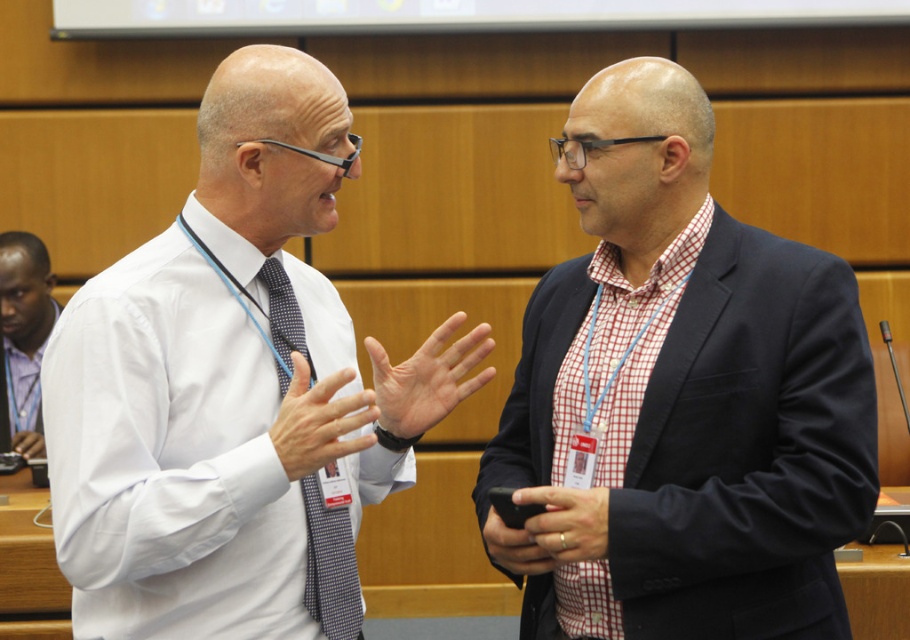
Can you confirm if red checkered shirt at center is smaller than purple checkered shirt at left?

Incorrect, red checkered shirt at center is not smaller in size than purple checkered shirt at left.

Is red checkered shirt at center wider than purple checkered shirt at left?

Correct, the width of red checkered shirt at center exceeds that of purple checkered shirt at left.

Which is in front, point (632, 484) or point (21, 243)?

Point (632, 484)

You are a GUI agent. You are given a task and a screenshot of the screen. Output one action in this format:
    pyautogui.click(x=<x>, y=<y>)
    Task: Click on the red checkered shirt at center
    The image size is (910, 640).
    Given the screenshot: What is the action you would take?
    pyautogui.click(x=681, y=397)

Who is taller, red checkered shirt at center or white shirt at center?

Standing taller between the two is red checkered shirt at center.

The height and width of the screenshot is (640, 910). What do you see at coordinates (681, 397) in the screenshot?
I see `red checkered shirt at center` at bounding box center [681, 397].

The width and height of the screenshot is (910, 640). I want to click on red checkered shirt at center, so [681, 397].

Does red checkered shirt at center have a lesser height compared to matte blue checkered tie at center?

Incorrect, red checkered shirt at center's height does not fall short of matte blue checkered tie at center's.

Can you confirm if red checkered shirt at center is positioned to the right of matte blue checkered tie at center?

Correct, you'll find red checkered shirt at center to the right of matte blue checkered tie at center.

This screenshot has height=640, width=910. Describe the element at coordinates (681, 397) in the screenshot. I see `red checkered shirt at center` at that location.

Image resolution: width=910 pixels, height=640 pixels. I want to click on red checkered shirt at center, so click(681, 397).